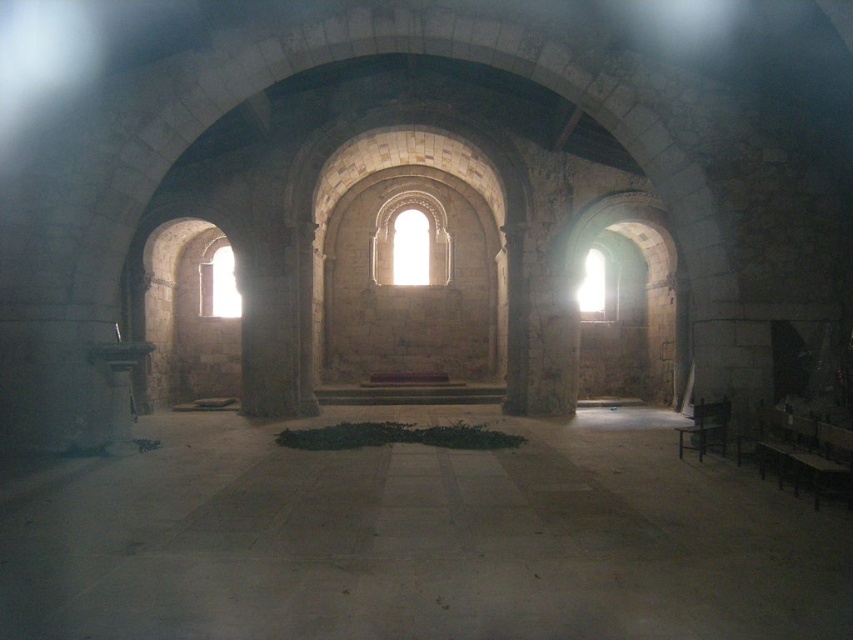
Question: Which of the following is the farthest from the observer?

Choices:
 (A) smooth stone floor at center
 (B) transparent glass window at left

Answer: (B)

Question: Does smooth stone floor at center have a greater width compared to transparent glass window at left?

Choices:
 (A) yes
 (B) no

Answer: (A)

Question: Does translucent stone window at center have a greater width compared to transparent glass window at left?

Choices:
 (A) no
 (B) yes

Answer: (A)

Question: Can you confirm if smooth stone floor at center is bigger than translucent stone window at center?

Choices:
 (A) yes
 (B) no

Answer: (A)

Question: Which is nearer to the translucent stone window at center?

Choices:
 (A) smooth stone floor at center
 (B) transparent glass window at left

Answer: (B)

Question: Which object appears closest to the camera in this image?

Choices:
 (A) transparent glass window at left
 (B) translucent stone window at center

Answer: (A)